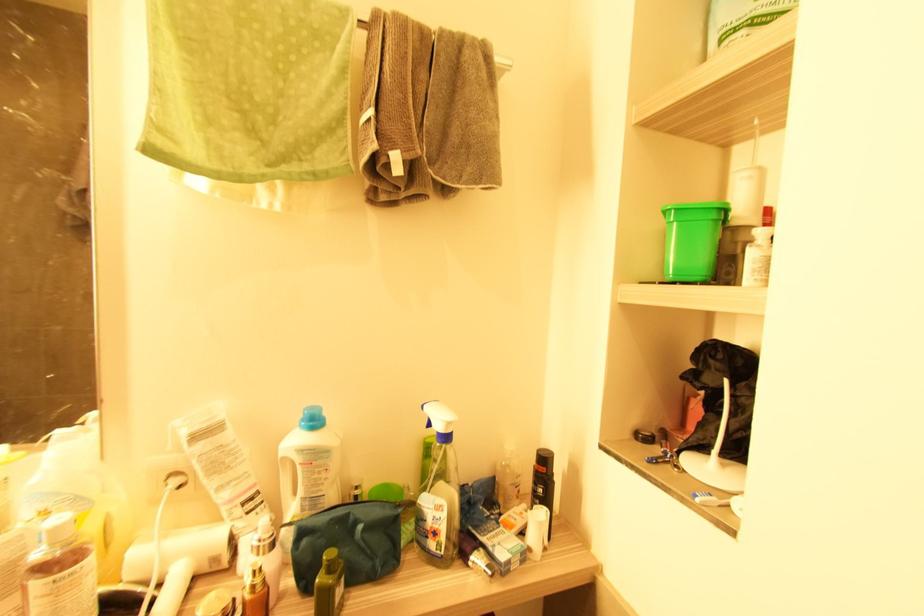
Which object does [759,252] point to?

This point indicates the bottle with red cap.